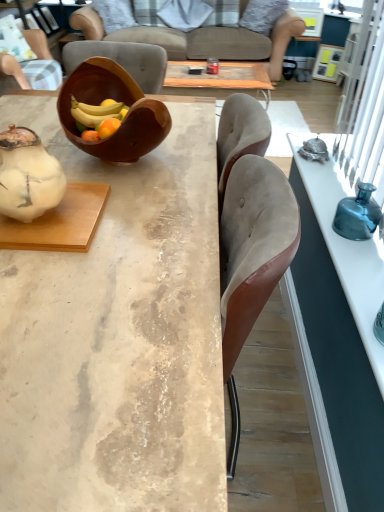
Locate an element on the screen. unoccupied region to the right of brown wooden bowl at center is located at coordinates (198, 156).